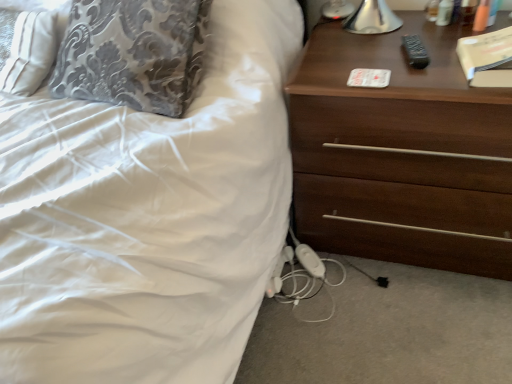
Question: From a real-world perspective, is beige matte book at upper right physically located above or below dark brown wood chest of drawers at right?

Choices:
 (A) above
 (B) below

Answer: (A)

Question: Relative to dark brown wood chest of drawers at right, is beige matte book at upper right in front or behind?

Choices:
 (A) behind
 (B) front

Answer: (A)

Question: From the image's perspective, relative to dark brown wood chest of drawers at right, is beige matte book at upper right above or below?

Choices:
 (A) above
 (B) below

Answer: (A)

Question: Is dark brown wood chest of drawers at right inside or outside of beige matte book at upper right?

Choices:
 (A) outside
 (B) inside

Answer: (A)

Question: Looking at the image, does dark brown wood chest of drawers at right seem bigger or smaller compared to beige matte book at upper right?

Choices:
 (A) big
 (B) small

Answer: (A)

Question: Is dark brown wood chest of drawers at right to the left or to the right of beige matte book at upper right in the image?

Choices:
 (A) left
 (B) right

Answer: (A)

Question: From a real-world perspective, relative to beige matte book at upper right, is dark brown wood chest of drawers at right vertically above or below?

Choices:
 (A) below
 (B) above

Answer: (A)